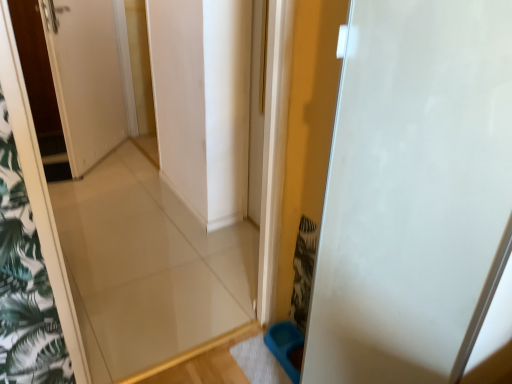
Question: Is white matte door at right, which is counted as the second door, starting from the left, inside the boundaries of white glossy door at upper left, positioned as the first door in top-to-bottom order, or outside?

Choices:
 (A) inside
 (B) outside

Answer: (B)

Question: Considering the positions of white matte door at right, arranged as the 2th door when viewed from the top, and white glossy door at upper left, which is counted as the 2th door, starting from the right, in the image, is white matte door at right, arranged as the 2th door when viewed from the top, taller or shorter than white glossy door at upper left, which is counted as the 2th door, starting from the right,?

Choices:
 (A) short
 (B) tall

Answer: (B)

Question: From a real-world perspective, is white matte door at right, the 1th door in the right-to-left sequence, physically located above or below white glossy door at upper left, positioned as the first door in top-to-bottom order?

Choices:
 (A) above
 (B) below

Answer: (A)

Question: Would you say white glossy door at upper left, positioned as the second door in front-to-back order, is inside or outside white matte door at right, the 1th door in the right-to-left sequence?

Choices:
 (A) inside
 (B) outside

Answer: (B)

Question: From their relative heights in the image, would you say white glossy door at upper left, which is the 2th door from bottom to top, is taller or shorter than white matte door at right, which is counted as the second door, starting from the left?

Choices:
 (A) short
 (B) tall

Answer: (A)

Question: In terms of size, does white glossy door at upper left, which is counted as the 2th door, starting from the right, appear bigger or smaller than white matte door at right, the 2th door in the back-to-front sequence?

Choices:
 (A) big
 (B) small

Answer: (B)

Question: From a real-world perspective, is white glossy door at upper left, the first door positioned from the back, positioned above or below white matte door at right, arranged as the 2th door when viewed from the top?

Choices:
 (A) above
 (B) below

Answer: (B)